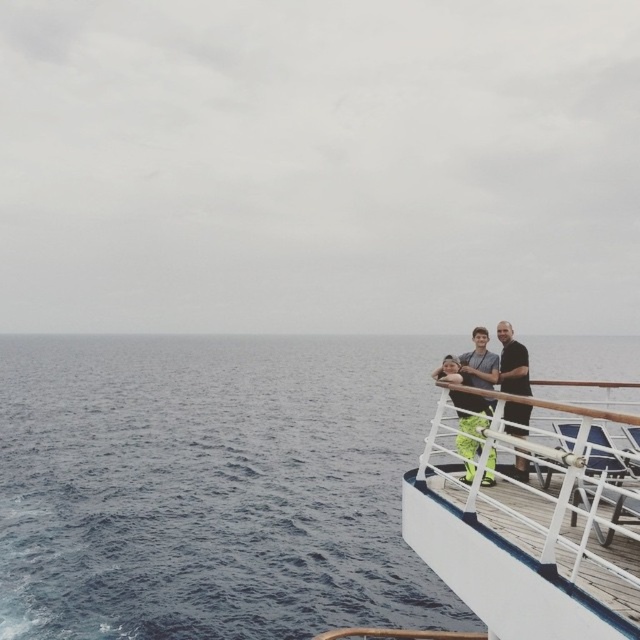
How far apart are blue water at lower left and dark blue shirt at right?

→ A distance of 117.69 meters exists between blue water at lower left and dark blue shirt at right.

Does blue water at lower left have a greater height compared to dark blue shirt at right?

Indeed, blue water at lower left has a greater height compared to dark blue shirt at right.

Who is more distant from viewer, [230,480] or [525,429]?

The point [230,480] is behind.

Locate an element on the screen. The width and height of the screenshot is (640, 640). blue water at lower left is located at coordinates (212, 486).

Does dark blue shirt at right appear on the left side of neon green fabric at center?

Correct, you'll find dark blue shirt at right to the left of neon green fabric at center.

Does point (518, 476) lie in front of point (522, 362)?

No, it is not.

Who is more distant from viewer, (506, 412) or (504, 332)?

The point (506, 412) is behind.

Find the location of a particular element. dark blue shirt at right is located at coordinates (513, 362).

Does dark blue shirt at right appear under dark brown leather jacket at right?

Correct, dark blue shirt at right is located below dark brown leather jacket at right.

Can you confirm if dark blue shirt at right is positioned above dark brown leather jacket at right?

Actually, dark blue shirt at right is below dark brown leather jacket at right.

Find the location of a particular element. This screenshot has width=640, height=640. dark blue shirt at right is located at coordinates (513, 362).

The image size is (640, 640). Find the location of `dark blue shirt at right`. dark blue shirt at right is located at coordinates (513, 362).